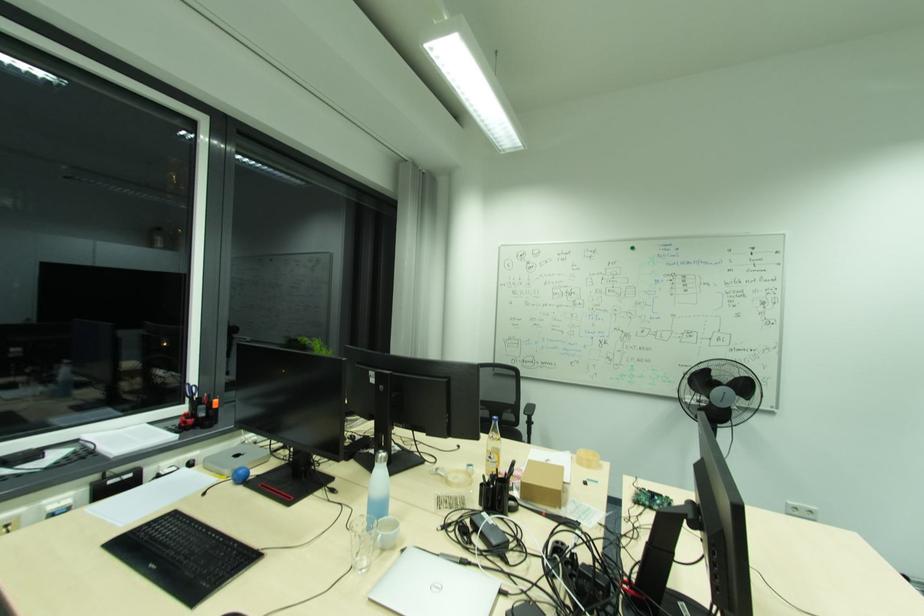
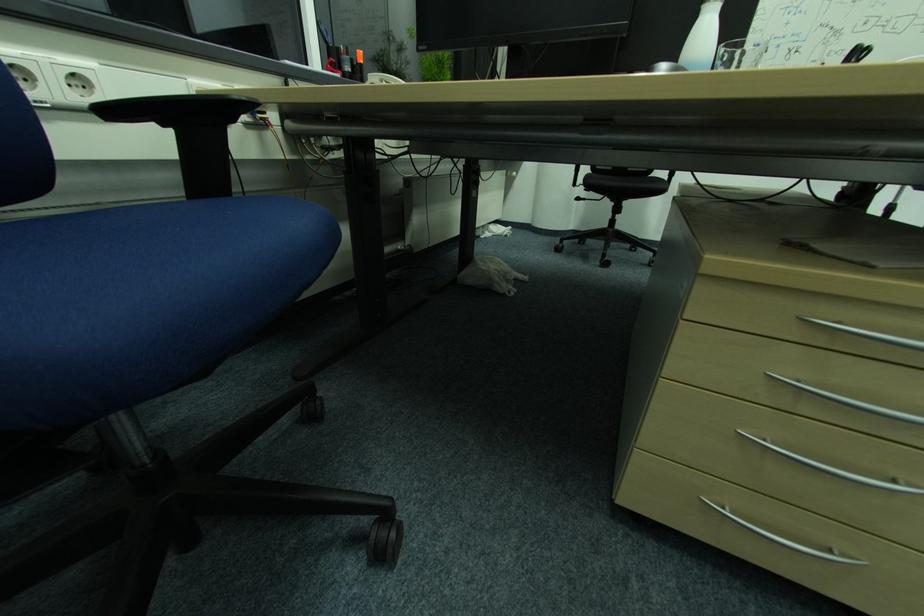
Question: Which direction would the cameraman need to move to produce the second image? Reply with the corresponding letter.

Choices:
 (A) Left
 (B) Right
 (C) Forward
 (D) Backward

Answer: (A)